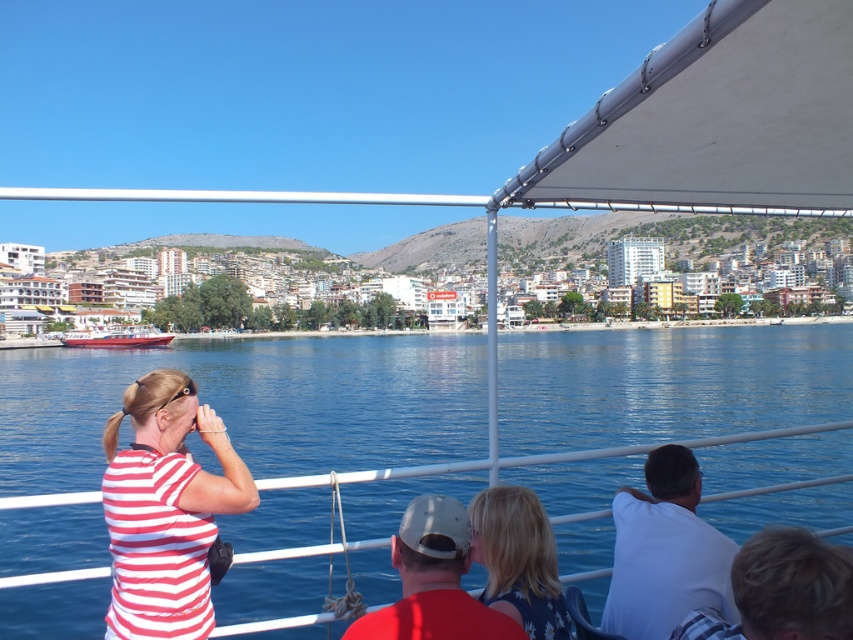
Is point (160, 588) closer to viewer compared to point (514, 493)?

Yes, point (160, 588) is closer to viewer.

How distant is striped cotton shirt at left from dark blue floral dress at center?

The distance of striped cotton shirt at left from dark blue floral dress at center is 21.92 meters.

Identify the location of striped cotton shirt at left. Image resolution: width=853 pixels, height=640 pixels. point(165,509).

Locate an element on the screen. striped cotton shirt at left is located at coordinates (165, 509).

Looking at this image, is striped cotton shirt at left wider than blonde hair at lower right?

Yes, striped cotton shirt at left is wider than blonde hair at lower right.

Who is taller, striped cotton shirt at left or blonde hair at lower right?

With more height is striped cotton shirt at left.

Identify the location of striped cotton shirt at left. (165, 509).

Does blonde hair at lower right appear over dark blue floral dress at center?

Correct, blonde hair at lower right is located above dark blue floral dress at center.

Is blonde hair at lower right to the right of dark blue floral dress at center from the viewer's perspective?

Correct, you'll find blonde hair at lower right to the right of dark blue floral dress at center.

Between point (824, 609) and point (514, 589), which one is positioned in front?

Positioned in front is point (824, 609).

Locate an element on the screen. This screenshot has width=853, height=640. blonde hair at lower right is located at coordinates (781, 589).